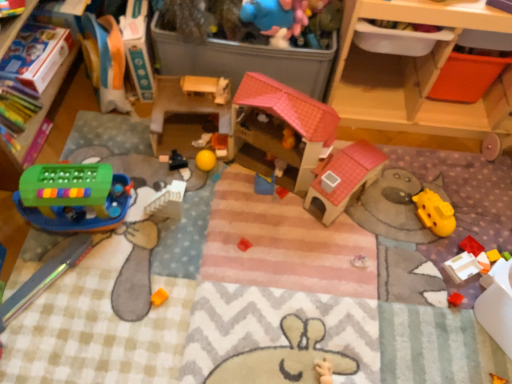
This screenshot has width=512, height=384. In order to click on free space between white plastic block at lower right, acting as the eighth toy starting from the left, and yellow plastic spoon at center, the 7th toy when ordered from left to right in this screenshot , I will do `click(366, 233)`.